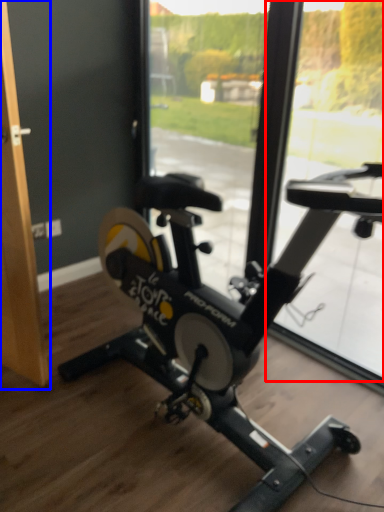
Question: Which object appears closest to the camera in this image, window screen (highlighted by a red box) or screen door (highlighted by a blue box)?

Choices:
 (A) window screen
 (B) screen door

Answer: (B)